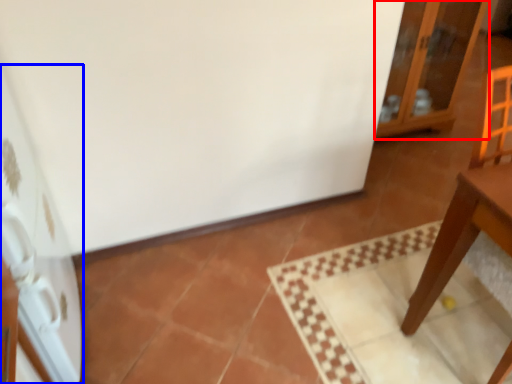
Question: Which object appears closest to the camera in this image, cabinetry (highlighted by a red box) or appliance (highlighted by a blue box)?

Choices:
 (A) cabinetry
 (B) appliance

Answer: (B)